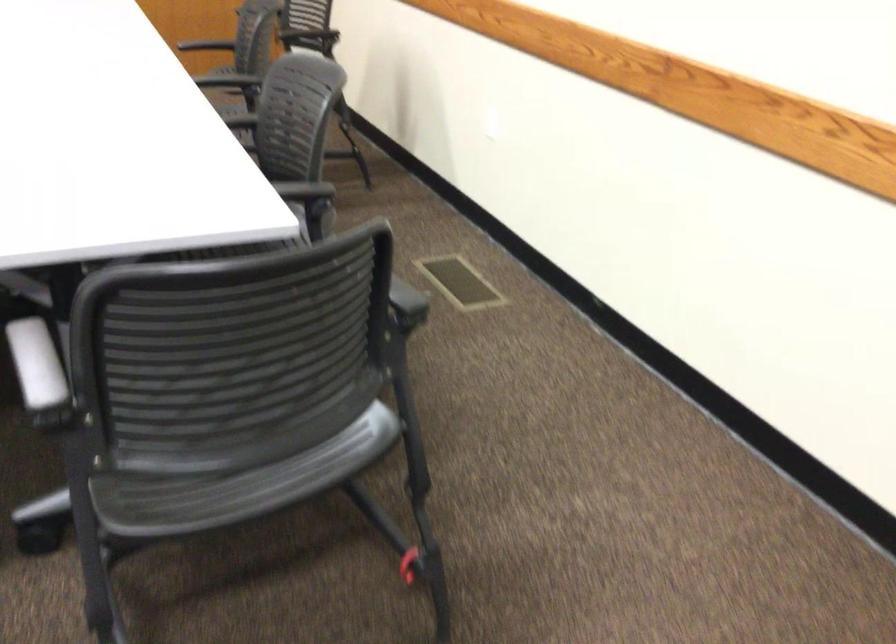
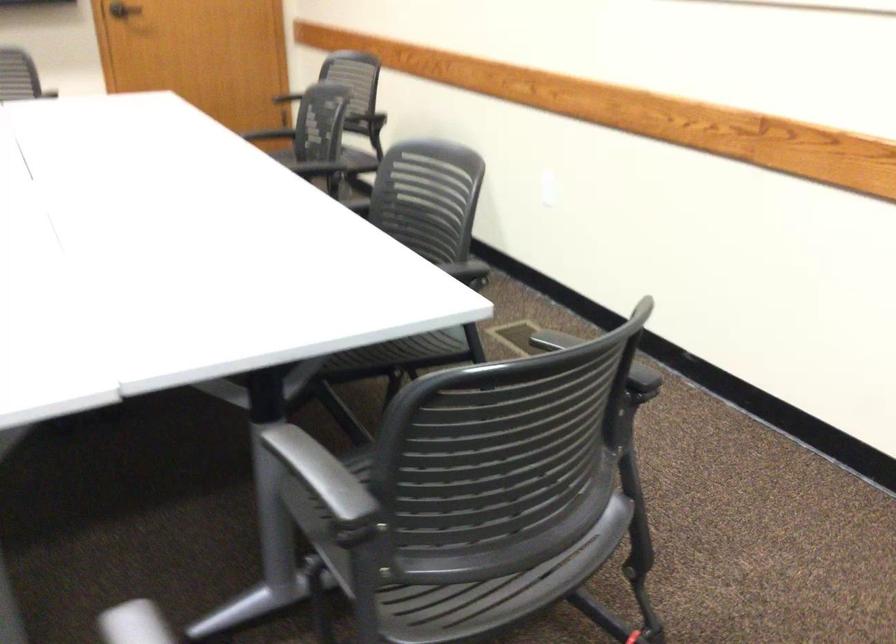
Find the pixel in the second image that matches [259,487] in the first image.

(496, 590)